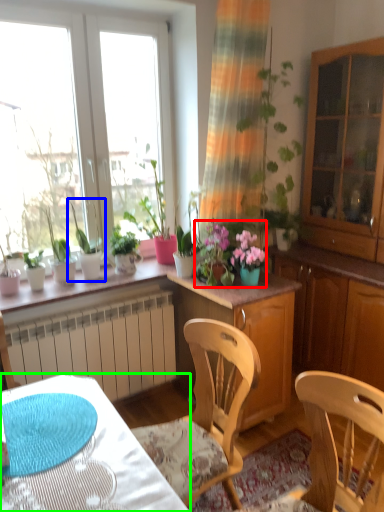
Question: Which object is positioned closest to floral arrangement (highlighted by a red box)? Select from houseplant (highlighted by a blue box) and desk (highlighted by a green box).

Choices:
 (A) houseplant
 (B) desk

Answer: (A)